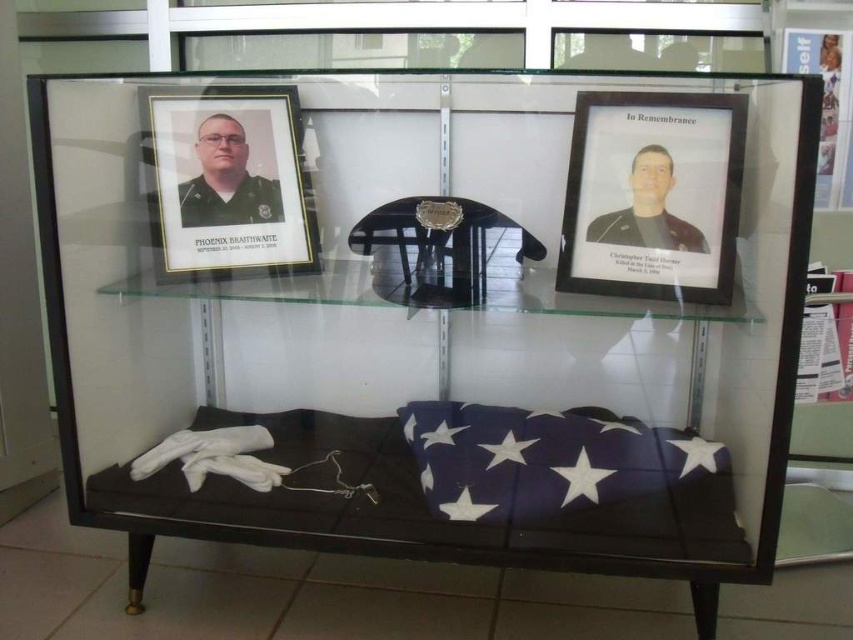
Question: Does black matte picture frame at upper right have a greater width compared to matte glass photo frame at upper left?

Choices:
 (A) yes
 (B) no

Answer: (B)

Question: Considering the real-world distances, which object is closest to the blue fabric flag at lower center?

Choices:
 (A) matte glass photo frame at upper left
 (B) matte black uniform at left
 (C) black matte picture frame at upper right

Answer: (C)

Question: Which object is farther from the camera taking this photo?

Choices:
 (A) blue fabric flag at lower center
 (B) black matte picture frame at upper right

Answer: (B)

Question: Does black matte picture frame at upper right appear on the left side of dark brown leather jacket at upper right?

Choices:
 (A) no
 (B) yes

Answer: (A)

Question: Is matte black uniform at left smaller than dark brown leather jacket at upper right?

Choices:
 (A) no
 (B) yes

Answer: (B)

Question: Which of these objects is positioned closest to the matte glass photo frame at upper left?

Choices:
 (A) black matte picture frame at upper right
 (B) matte black uniform at left
 (C) blue fabric flag at lower center

Answer: (B)